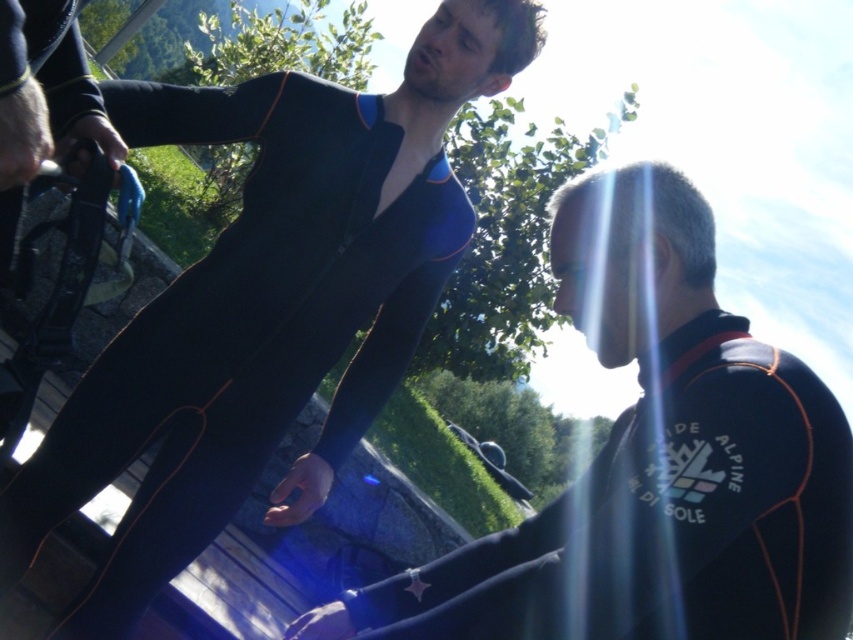
You are a photographer standing at a specific spot and want to capture a closeup shot of the black neoprene wetsuit at center. Given that your camera has a minimum focusing distance of 5 feet, will you be able to take the photo without moving closer?

The black neoprene wetsuit at center is 4.84 feet away from the camera, which is less than the minimum focusing distance of 5 feet. Therefore, you will not be able to take the closeup shot without moving further away or adjusting your equipment.

You are a lifeguard observing two people in wetsuits at the pool. The black neoprene wetsuit at center and the black neoprene wetsuit at right are both in your line of sight. Which one is positioned to the left side of the other?

The black neoprene wetsuit at center is positioned to the left of the black neoprene wetsuit at right.